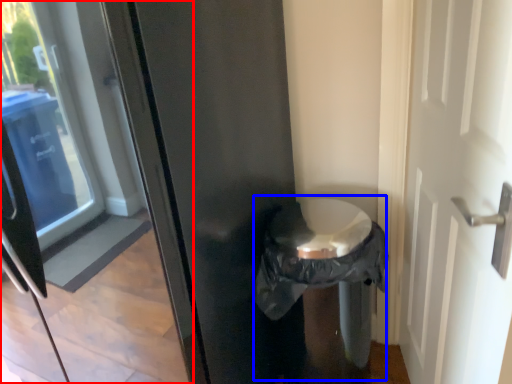
Question: Which of the following is the closest to the observer, glass door (highlighted by a red box) or garbage (highlighted by a blue box)?

Choices:
 (A) glass door
 (B) garbage

Answer: (A)